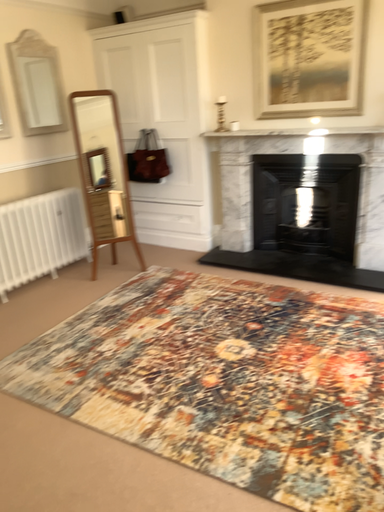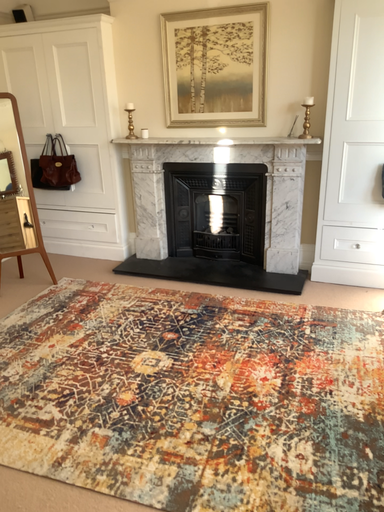
Question: Which way did the camera rotate in the video?

Choices:
 (A) rotated right
 (B) rotated left

Answer: (A)